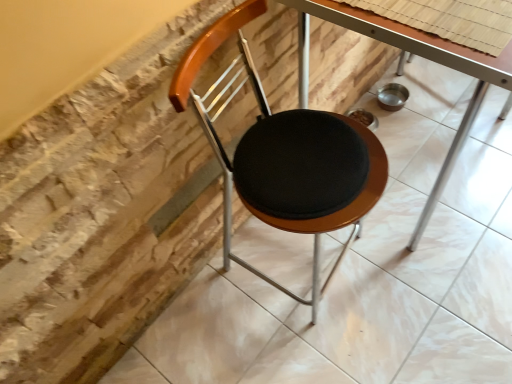
Question: Is matte black seat at center closer to the viewer compared to metallic silver table at center?

Choices:
 (A) yes
 (B) no

Answer: (A)

Question: Does matte black seat at center touch metallic silver table at center?

Choices:
 (A) yes
 (B) no

Answer: (B)

Question: Considering the relative positions of matte black seat at center and metallic silver table at center in the image provided, is matte black seat at center to the left of metallic silver table at center from the viewer's perspective?

Choices:
 (A) no
 (B) yes

Answer: (B)

Question: From the image's perspective, would you say matte black seat at center is positioned over metallic silver table at center?

Choices:
 (A) no
 (B) yes

Answer: (A)

Question: Does matte black seat at center have a smaller size compared to metallic silver table at center?

Choices:
 (A) yes
 (B) no

Answer: (A)

Question: Does matte black seat at center turn towards metallic silver table at center?

Choices:
 (A) yes
 (B) no

Answer: (B)

Question: Is metallic silver table at center at the right side of matte black seat at center?

Choices:
 (A) yes
 (B) no

Answer: (A)

Question: Does metallic silver table at center lie in front of matte black seat at center?

Choices:
 (A) no
 (B) yes

Answer: (A)

Question: Is metallic silver table at center turned away from matte black seat at center?

Choices:
 (A) no
 (B) yes

Answer: (A)

Question: From the image's perspective, is metallic silver table at center below matte black seat at center?

Choices:
 (A) no
 (B) yes

Answer: (A)

Question: Can you confirm if metallic silver table at center is positioned to the left of matte black seat at center?

Choices:
 (A) no
 (B) yes

Answer: (A)

Question: Is the surface of metallic silver table at center in direct contact with matte black seat at center?

Choices:
 (A) no
 (B) yes

Answer: (A)

Question: From the image's perspective, relative to matte black seat at center, is metallic silver table at center above or below?

Choices:
 (A) below
 (B) above

Answer: (B)